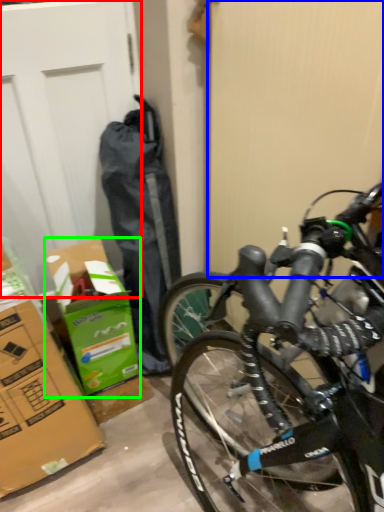
Question: Considering the real-world distances, which object is closest to garage door (highlighted by a red box)? screen door (highlighted by a blue box) or cardboard box (highlighted by a green box).

Choices:
 (A) screen door
 (B) cardboard box

Answer: (B)